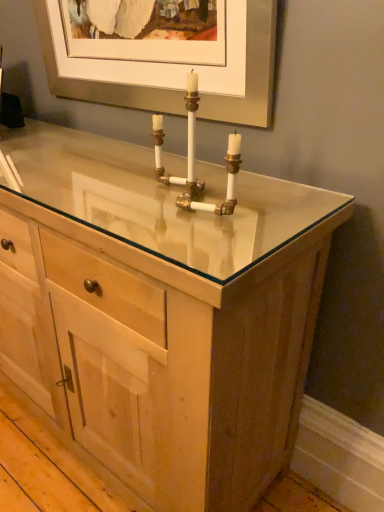
Find the location of `free spot to the right of white brass pipe at center`. free spot to the right of white brass pipe at center is located at coordinates (273, 201).